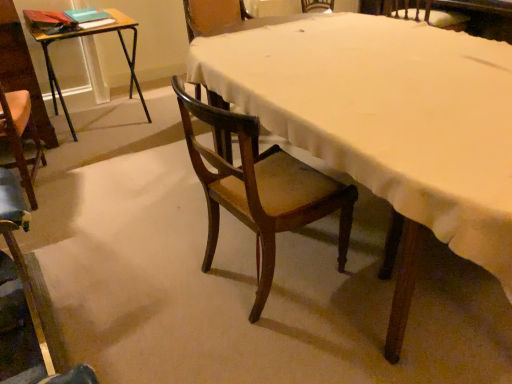
Question: Is wooden chair at center, positioned as the third chair in left-to-right order, situated inside wooden chair at upper right, arranged as the fourth chair when viewed from the left, or outside?

Choices:
 (A) inside
 (B) outside

Answer: (B)

Question: Considering the positions of wooden chair at center, positioned as the third chair in left-to-right order, and wooden chair at upper right, arranged as the fourth chair when viewed from the left, in the image, is wooden chair at center, positioned as the third chair in left-to-right order, wider or thinner than wooden chair at upper right, arranged as the fourth chair when viewed from the left,?

Choices:
 (A) thin
 (B) wide

Answer: (A)

Question: Based on their relative distances, which object is farther from the wooden chair at center?

Choices:
 (A) wooden desk at left
 (B) wooden chair at center, positioned as the third chair in left-to-right order
 (C) wooden chair at lower left, the 1th chair viewed from the left
 (D) wooden chair at center, the 2th chair from the left
 (E) wooden chair at upper right, marked as the first chair in a right-to-left arrangement

Answer: (D)

Question: Estimate the real-world distances between objects in this image. Which object is closer to the wooden chair at center, the 2th chair from the left?

Choices:
 (A) wooden chair at lower left, the 1th chair viewed from the left
 (B) wooden chair at upper right, arranged as the fourth chair when viewed from the left
 (C) wooden desk at left
 (D) wooden chair at center
 (E) wooden chair at center, arranged as the second chair when viewed from the right

Answer: (C)